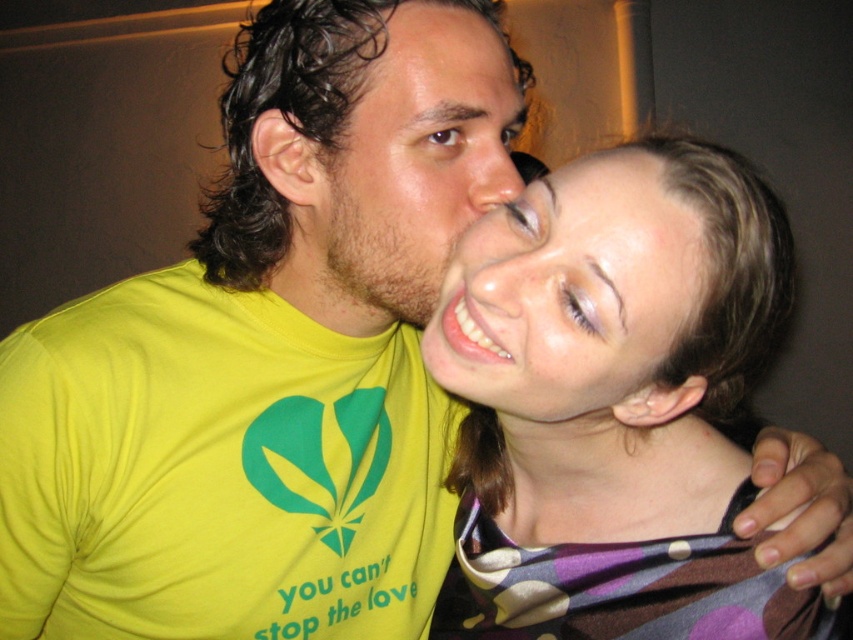
Question: Which point is farther to the camera?

Choices:
 (A) brown matte skin at center
 (B) smooth skin face at center
 (C) multicolored fabric scarf at center

Answer: (A)

Question: Considering the real-world distances, which object is farthest from the multicolored fabric scarf at center?

Choices:
 (A) brown matte skin at center
 (B) smooth skin face at center

Answer: (A)

Question: Observing the image, what is the correct spatial positioning of multicolored fabric scarf at center in reference to brown matte skin at center?

Choices:
 (A) above
 (B) below

Answer: (B)

Question: Does multicolored fabric scarf at center appear over smooth skin face at center?

Choices:
 (A) no
 (B) yes

Answer: (A)

Question: Which point is closer to the camera?

Choices:
 (A) smooth skin face at center
 (B) brown matte skin at center
 (C) multicolored fabric scarf at center

Answer: (C)

Question: Is multicolored fabric scarf at center to the right of brown matte skin at center from the viewer's perspective?

Choices:
 (A) yes
 (B) no

Answer: (A)